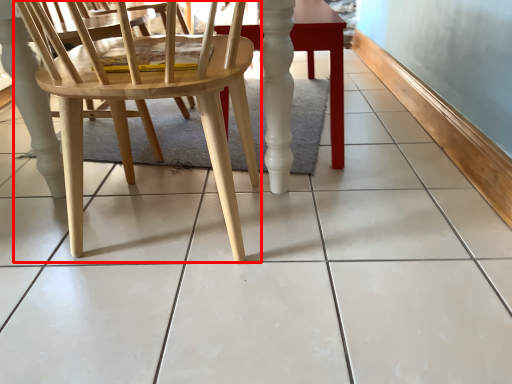
Question: From the image's perspective, where is chair (annotated by the red box) located in relation to table in the image?

Choices:
 (A) above
 (B) below

Answer: (B)